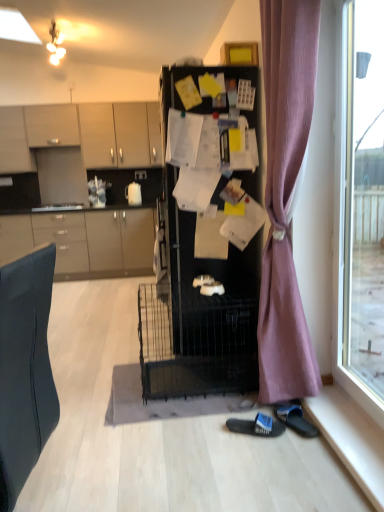
Question: From a real-world perspective, is black rubber slipper at lower right, acting as the first footwear starting from the right, positioned under purple fabric curtain at right based on gravity?

Choices:
 (A) yes
 (B) no

Answer: (A)

Question: Is black rubber slipper at lower right, positioned as the second footwear in left-to-right order, positioned beyond the bounds of purple fabric curtain at right?

Choices:
 (A) yes
 (B) no

Answer: (B)

Question: From the image's perspective, is black rubber slipper at lower right, acting as the first footwear starting from the right, over purple fabric curtain at right?

Choices:
 (A) no
 (B) yes

Answer: (A)

Question: Is black rubber slipper at lower right, acting as the first footwear starting from the right, looking in the opposite direction of purple fabric curtain at right?

Choices:
 (A) yes
 (B) no

Answer: (A)

Question: Can you confirm if black rubber slipper at lower right, acting as the first footwear starting from the right, is smaller than purple fabric curtain at right?

Choices:
 (A) yes
 (B) no

Answer: (A)

Question: Considering the relative sizes of black rubber slipper at lower right, positioned as the second footwear in left-to-right order, and purple fabric curtain at right in the image provided, is black rubber slipper at lower right, positioned as the second footwear in left-to-right order, thinner than purple fabric curtain at right?

Choices:
 (A) no
 (B) yes

Answer: (B)

Question: Is the depth of matte beige cabinets at upper left, which appears as the 3th cabinetry when ordered from the bottom, less than that of black rubber slipper at lower right, positioned as the second footwear in left-to-right order?

Choices:
 (A) yes
 (B) no

Answer: (B)

Question: Is matte beige cabinets at upper left, which appears as the 3th cabinetry when ordered from the bottom, at the right side of black rubber slipper at lower right, acting as the first footwear starting from the right?

Choices:
 (A) no
 (B) yes

Answer: (A)

Question: Is matte beige cabinets at upper left, positioned as the 2th cabinetry in top-to-bottom order, next to black rubber slipper at lower right, positioned as the second footwear in left-to-right order, and touching it?

Choices:
 (A) yes
 (B) no

Answer: (B)

Question: Could you tell me if matte beige cabinets at upper left, which appears as the 3th cabinetry when ordered from the bottom, is facing black rubber slipper at lower right, positioned as the second footwear in left-to-right order?

Choices:
 (A) yes
 (B) no

Answer: (B)

Question: Is the position of matte beige cabinets at upper left, positioned as the 2th cabinetry in top-to-bottom order, more distant than that of black rubber slipper at lower right, acting as the first footwear starting from the right?

Choices:
 (A) yes
 (B) no

Answer: (A)

Question: Does matte beige cabinets at upper left, positioned as the 2th cabinetry in top-to-bottom order, have a lesser width compared to black rubber slipper at lower right, acting as the first footwear starting from the right?

Choices:
 (A) yes
 (B) no

Answer: (B)

Question: Is black fabric slipper at lower center, the 2th footwear positioned from the right, located outside matte white cabinet at upper left, the 4th cabinetry positioned from the bottom?

Choices:
 (A) no
 (B) yes

Answer: (B)